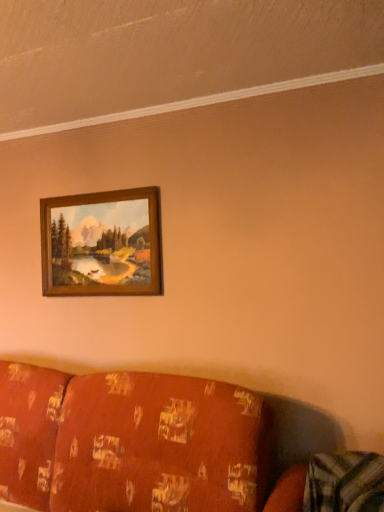
Question: Is the depth of patterned fabric couch at lower left greater than that of wooden frame at upper center?

Choices:
 (A) yes
 (B) no

Answer: (B)

Question: Would you say patterned fabric couch at lower left is outside wooden frame at upper center?

Choices:
 (A) yes
 (B) no

Answer: (A)

Question: Is patterned fabric couch at lower left closer to camera compared to wooden frame at upper center?

Choices:
 (A) no
 (B) yes

Answer: (B)

Question: Is patterned fabric couch at lower left turned away from wooden frame at upper center?

Choices:
 (A) yes
 (B) no

Answer: (B)

Question: Is patterned fabric couch at lower left shorter than wooden frame at upper center?

Choices:
 (A) no
 (B) yes

Answer: (A)

Question: Is patterned fabric couch at lower left oriented towards wooden frame at upper center?

Choices:
 (A) yes
 (B) no

Answer: (B)

Question: Is wooden frame at upper center thinner than patterned fabric couch at lower left?

Choices:
 (A) yes
 (B) no

Answer: (A)

Question: Would you say patterned fabric couch at lower left is part of wooden frame at upper center's contents?

Choices:
 (A) yes
 (B) no

Answer: (B)

Question: Is wooden frame at upper center shorter than patterned fabric couch at lower left?

Choices:
 (A) yes
 (B) no

Answer: (A)

Question: Is wooden frame at upper center facing towards patterned fabric couch at lower left?

Choices:
 (A) no
 (B) yes

Answer: (A)

Question: Can you confirm if wooden frame at upper center is wider than patterned fabric couch at lower left?

Choices:
 (A) no
 (B) yes

Answer: (A)

Question: From the image's perspective, does wooden frame at upper center appear lower than patterned fabric couch at lower left?

Choices:
 (A) no
 (B) yes

Answer: (A)

Question: Considering the positions of wooden frame at upper center and patterned fabric couch at lower left in the image, is wooden frame at upper center taller or shorter than patterned fabric couch at lower left?

Choices:
 (A) tall
 (B) short

Answer: (B)